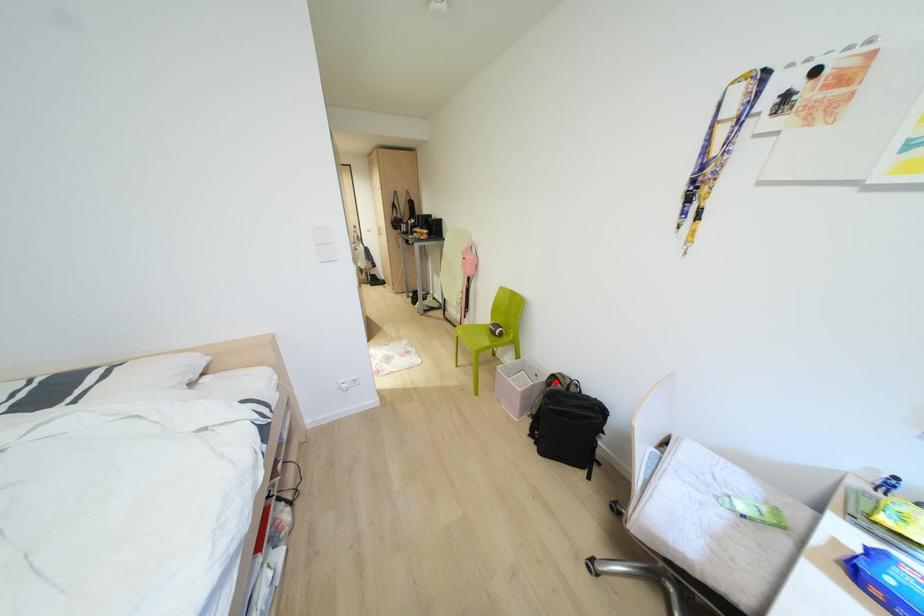
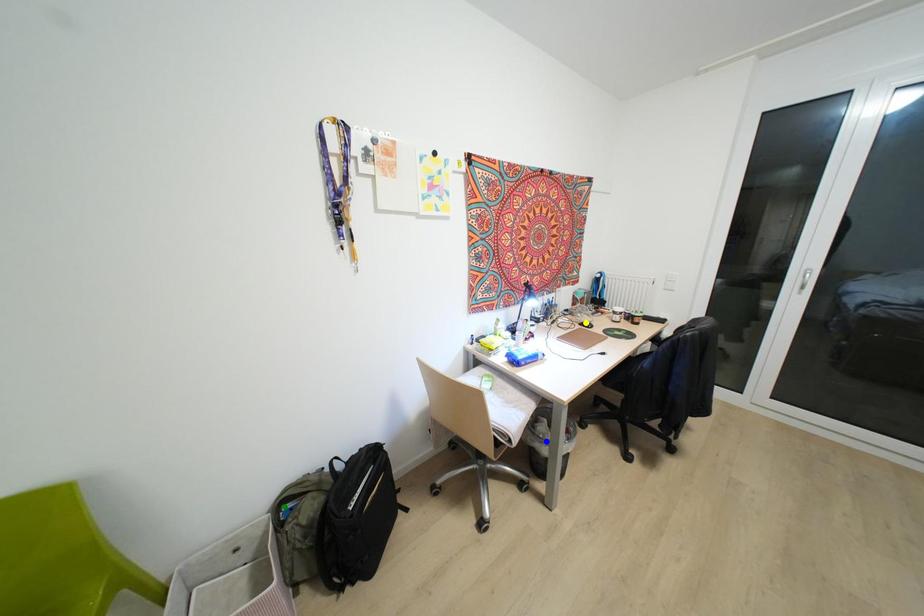
Question: I am providing you with two images of the same scene from different viewpoints. A red point is marked on the first image. You are given multiple points on the second image. Which spot in image 2 lines up with the point in image 1?

Choices:
 (A) yellow point
 (B) blue point
 (C) green point

Answer: (C)